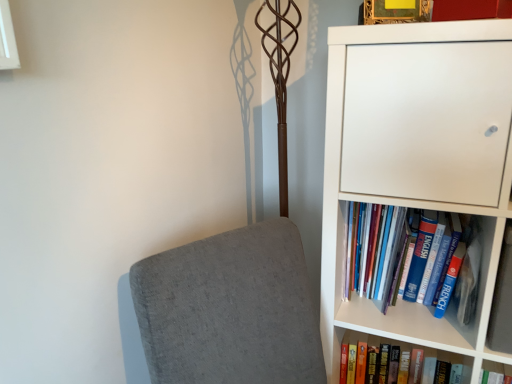
Question: From the image's perspective, is blue hardcover book at right, arranged as the 2th book when ordered from the bottom, located above or below white glossy window at upper left?

Choices:
 (A) above
 (B) below

Answer: (B)

Question: Is blue hardcover book at right, arranged as the 2th book when ordered from the bottom, inside or outside of white glossy window at upper left?

Choices:
 (A) inside
 (B) outside

Answer: (B)

Question: Estimate the real-world distances between objects in this image. Which object is closer to the hardcover book at lower right, which is the 1th book in bottom-to-top order?

Choices:
 (A) white glossy window at upper left
 (B) white matte bookcase at right
 (C) blue hardcover book at right, arranged as the 2th book when ordered from the bottom

Answer: (C)

Question: Which is nearer to the hardcover book at lower right, the second book viewed from the top?

Choices:
 (A) blue hardcover book at right, positioned as the first book in top-to-bottom order
 (B) white glossy window at upper left
 (C) white matte bookcase at right

Answer: (A)